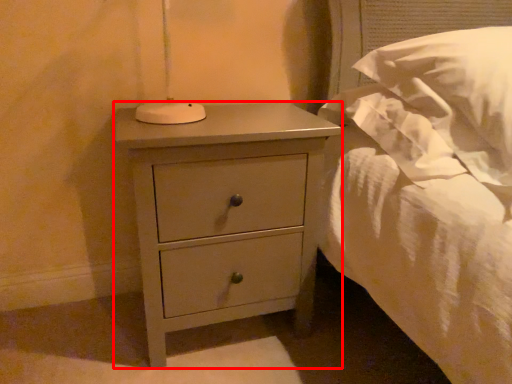
Question: From the image's perspective, what is the correct spatial positioning of nightstand (annotated by the red box) in reference to pillow?

Choices:
 (A) below
 (B) above

Answer: (A)